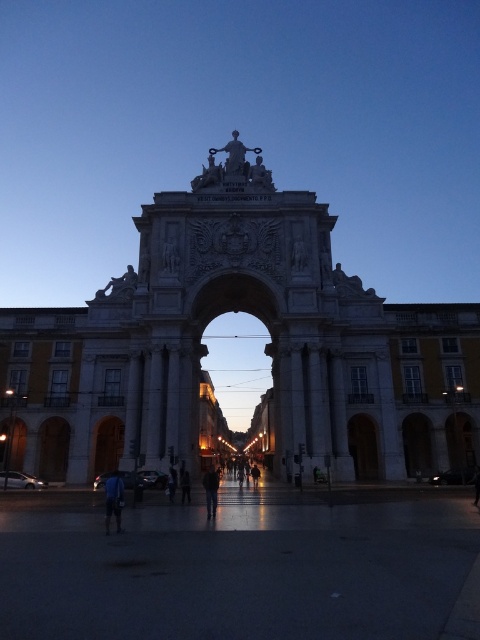
Question: Considering the relative positions of blue fabric at lower left and dark blue fabric at center in the image provided, where is blue fabric at lower left located with respect to dark blue fabric at center?

Choices:
 (A) above
 (B) below

Answer: (A)

Question: Is blue fabric at lower left above dark blue fabric at center?

Choices:
 (A) no
 (B) yes

Answer: (B)

Question: Can you confirm if blue fabric at lower left is positioned below dark blue fabric at center?

Choices:
 (A) yes
 (B) no

Answer: (B)

Question: Which point appears farthest from the camera in this image?

Choices:
 (A) (116, 513)
 (B) (210, 484)

Answer: (B)

Question: Which of the following is the farthest from the observer?

Choices:
 (A) blue fabric at lower left
 (B) dark blue fabric at center

Answer: (B)